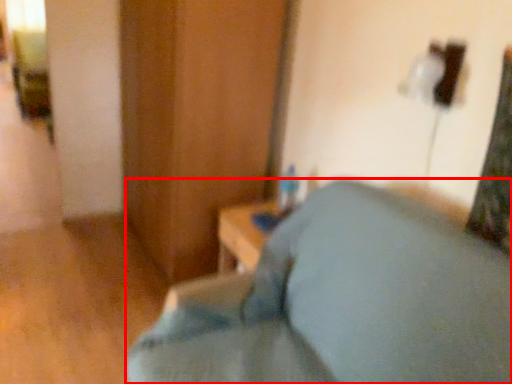
Question: From the image, what is the correct spatial relationship of furniture (annotated by the red box) in relation to dresser?

Choices:
 (A) left
 (B) right

Answer: (B)